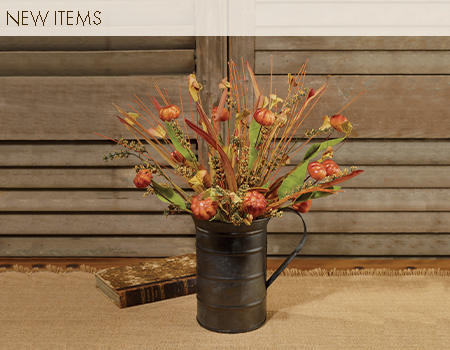
The image size is (450, 350). I want to click on old jug, so click(x=220, y=279).